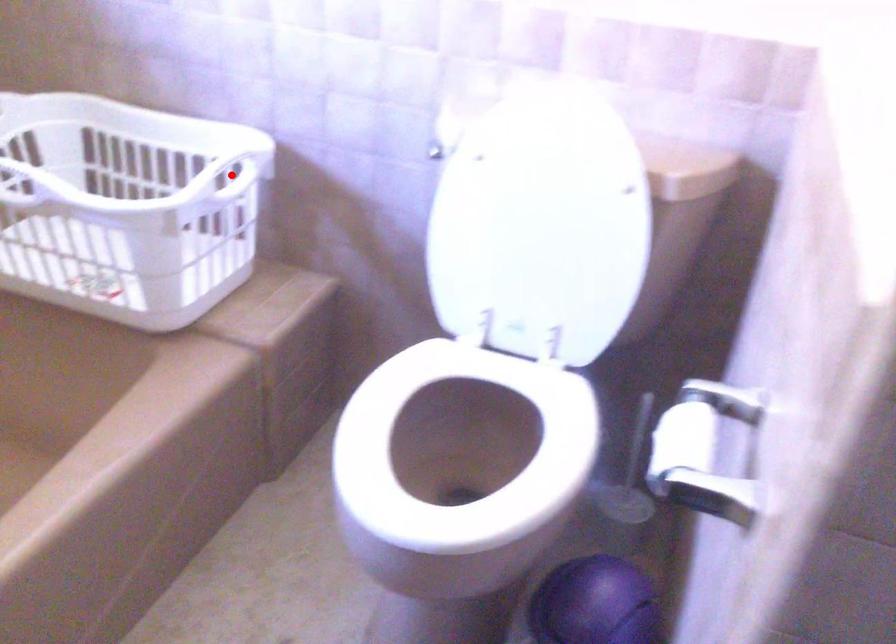
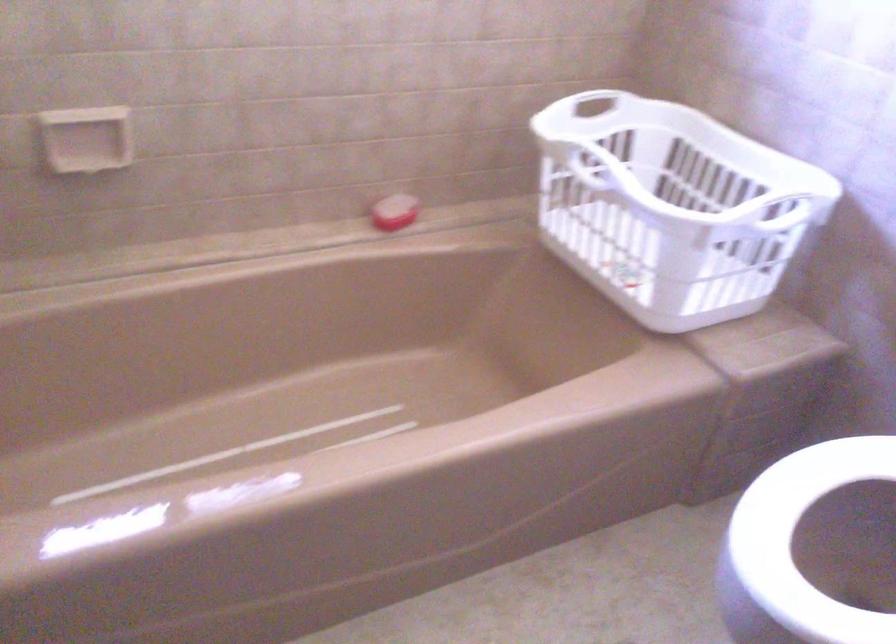
Question: I am providing you with two images of the same scene from different viewpoints. A red point is shown in image1. For the corresponding object point in image2, is it positioned nearer or farther from the camera?

Choices:
 (A) Nearer
 (B) Farther

Answer: (A)